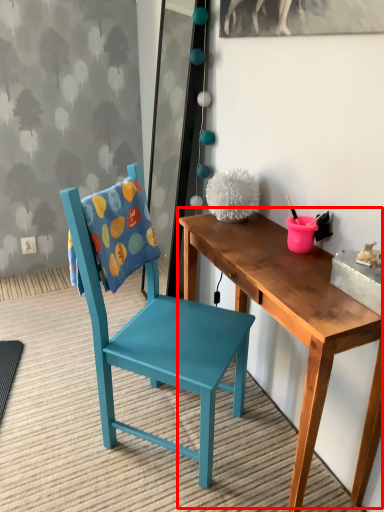
Question: In this image, where is table (annotated by the red box) located relative to chair?

Choices:
 (A) left
 (B) right

Answer: (B)